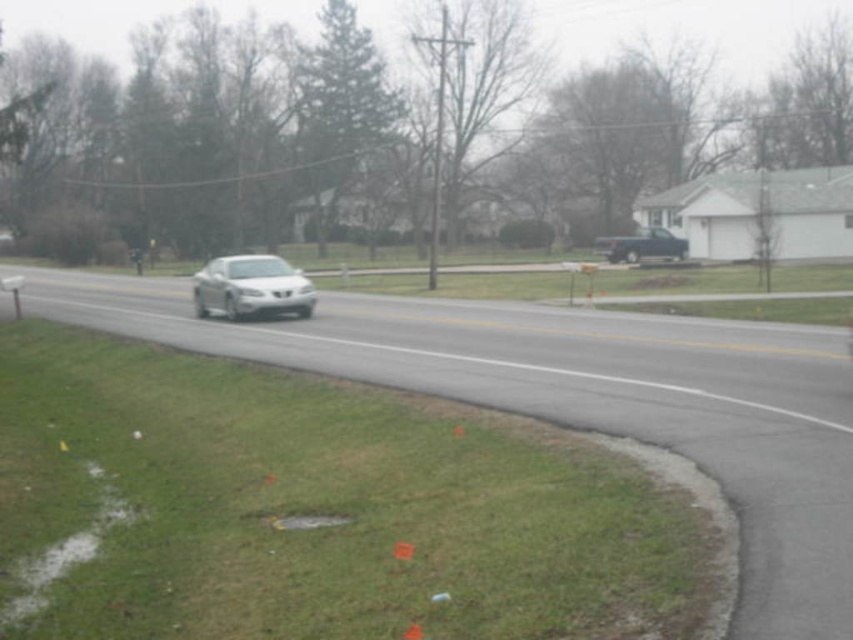
Question: Which of the following is the closest to the observer?

Choices:
 (A) (239, 308)
 (B) (677, 259)

Answer: (A)

Question: Can you confirm if satin silver sedan at center is bigger than metallic blue truck at right?

Choices:
 (A) yes
 (B) no

Answer: (A)

Question: Does satin silver sedan at center appear under metallic blue truck at right?

Choices:
 (A) no
 (B) yes

Answer: (B)

Question: Can you confirm if satin silver sedan at center is wider than metallic blue truck at right?

Choices:
 (A) no
 (B) yes

Answer: (B)

Question: Which point appears farthest from the camera in this image?

Choices:
 (A) (654, 228)
 (B) (259, 266)

Answer: (A)